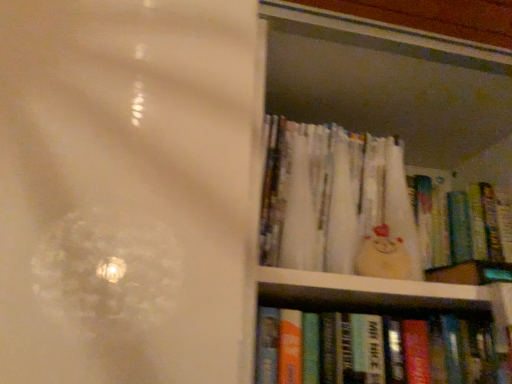
Question: Is the position of hardcover book at lower right, the 3th book viewed from the top, less distant than that of hardcover books at right?

Choices:
 (A) no
 (B) yes

Answer: (A)

Question: Can you confirm if hardcover book at lower right, which is the first book from bottom to top, is taller than hardcover books at right?

Choices:
 (A) yes
 (B) no

Answer: (B)

Question: Does hardcover book at lower right, the 3th book viewed from the top, have a lesser height compared to hardcover books at right?

Choices:
 (A) no
 (B) yes

Answer: (B)

Question: Is hardcover book at lower right, the 3th book viewed from the top, further to camera compared to hardcover books at right?

Choices:
 (A) no
 (B) yes

Answer: (B)

Question: Could hardcover books at right be considered to be inside hardcover book at lower right, the 3th book viewed from the top?

Choices:
 (A) no
 (B) yes

Answer: (A)

Question: From a real-world perspective, is hardcover book at lower right, the 3th book viewed from the top, physically above hardcover books at right?

Choices:
 (A) no
 (B) yes

Answer: (A)

Question: Does matte plastic book at upper right, the second book ordered from the bottom, have a greater width compared to hardcover books at right?

Choices:
 (A) no
 (B) yes

Answer: (A)

Question: Does matte plastic book at upper right, which is the second book from top to bottom, have a smaller size compared to hardcover books at right?

Choices:
 (A) yes
 (B) no

Answer: (A)

Question: Is matte plastic book at upper right, which is the second book from top to bottom, positioned far away from hardcover books at right?

Choices:
 (A) no
 (B) yes

Answer: (A)

Question: From the image's perspective, is matte plastic book at upper right, which is the second book from top to bottom, below hardcover books at right?

Choices:
 (A) no
 (B) yes

Answer: (B)

Question: From a real-world perspective, is matte plastic book at upper right, which is the second book from top to bottom, over hardcover books at right?

Choices:
 (A) no
 (B) yes

Answer: (B)

Question: Considering the relative sizes of matte plastic book at upper right, the second book ordered from the bottom, and hardcover books at right in the image provided, is matte plastic book at upper right, the second book ordered from the bottom, shorter than hardcover books at right?

Choices:
 (A) yes
 (B) no

Answer: (A)

Question: Is hardcover books at right surrounding white paper book at upper right, which is the 1th book in top-to-bottom order?

Choices:
 (A) yes
 (B) no

Answer: (A)